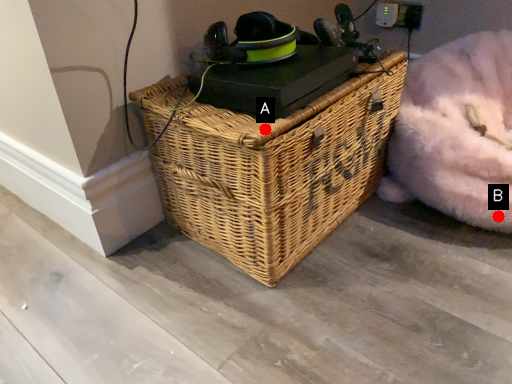
Question: Two points are circled on the image, labeled by A and B beside each circle. Among these points, which one is nearest to the camera?

Choices:
 (A) A is closer
 (B) B is closer

Answer: (A)